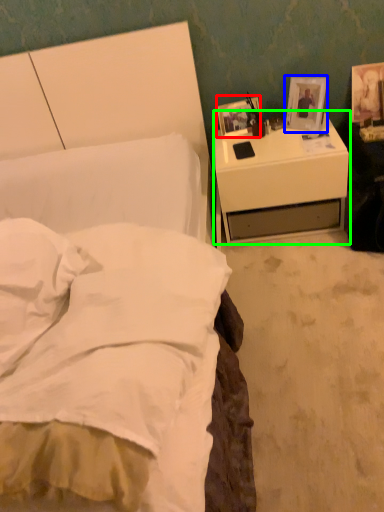
Question: Which object is positioned farthest from picture frame (highlighted by a red box)? Select from picture frame (highlighted by a blue box) and nightstand (highlighted by a green box).

Choices:
 (A) picture frame
 (B) nightstand

Answer: (B)